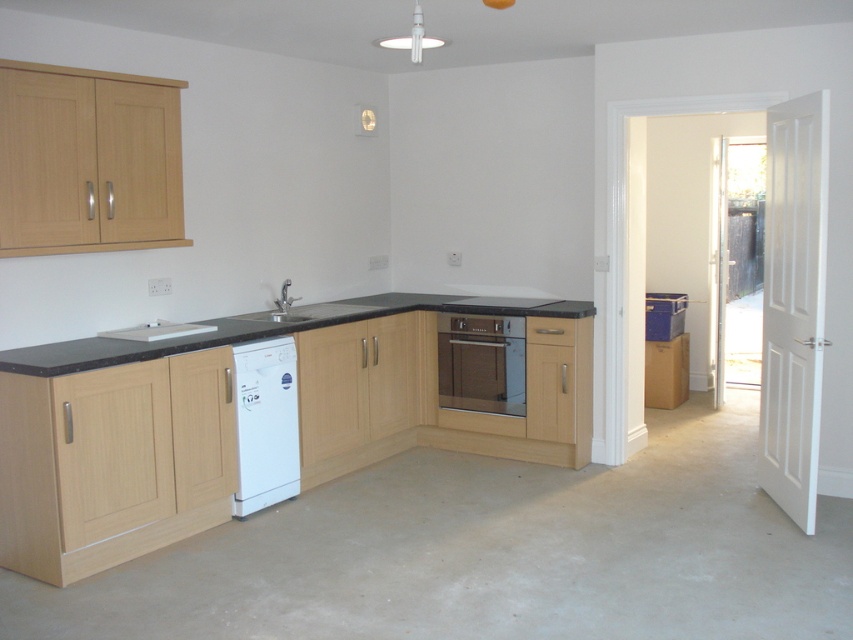
Question: Does matte brown oven at center appear over matte silver sink at center?

Choices:
 (A) no
 (B) yes

Answer: (A)

Question: Based on their relative distances, which object is nearer to the white glossy dishwasher at lower left?

Choices:
 (A) black granite countertop at center
 (B) matte brown oven at center
 (C) matte silver sink at center

Answer: (A)

Question: Which object appears farthest from the camera in this image?

Choices:
 (A) white glossy dishwasher at lower left
 (B) matte silver sink at center

Answer: (B)

Question: Can you confirm if black granite countertop at center is bigger than white glossy dishwasher at lower left?

Choices:
 (A) yes
 (B) no

Answer: (A)

Question: Does black granite countertop at center have a greater width compared to white glossy dishwasher at lower left?

Choices:
 (A) yes
 (B) no

Answer: (A)

Question: Estimate the real-world distances between objects in this image. Which object is closer to the matte brown oven at center?

Choices:
 (A) black granite countertop at center
 (B) white glossy dishwasher at lower left
 (C) matte silver sink at center

Answer: (A)